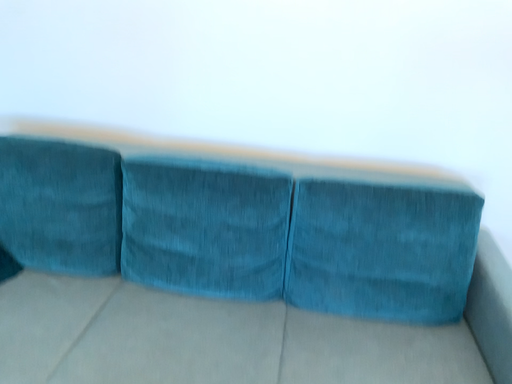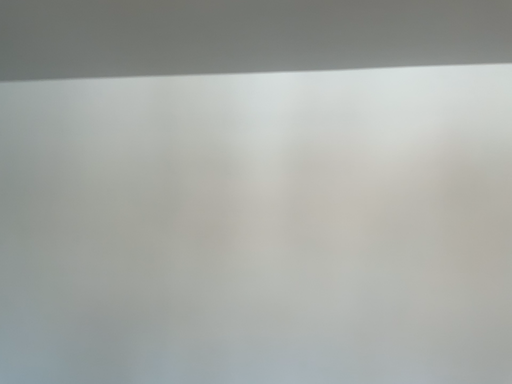
Question: How did the camera likely rotate when shooting the video?

Choices:
 (A) rotated downward
 (B) rotated upward

Answer: (B)